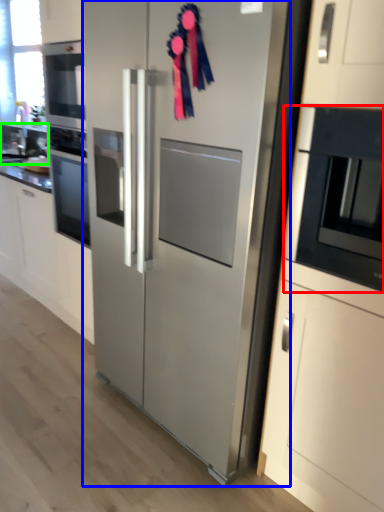
Question: Considering the real-world distances, which object is closest to microwave oven (highlighted by a red box)? refrigerator (highlighted by a blue box) or sink (highlighted by a green box).

Choices:
 (A) refrigerator
 (B) sink

Answer: (A)